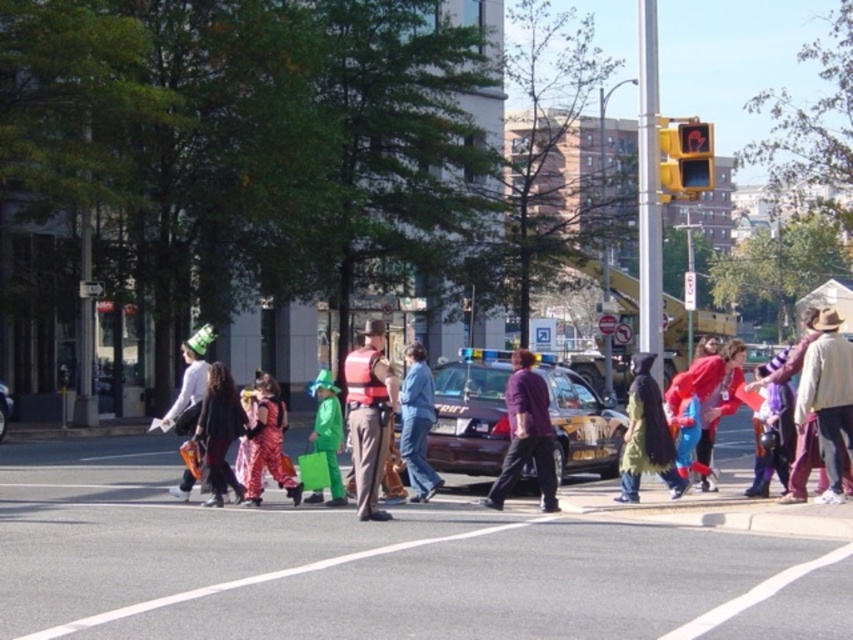
You are standing at the starting point of the pedestrian crosswalk and want to reach the point marked as point (228, 406). However, there is an obstacle at point (659, 394). Will you need to go around it to reach your destination?

Yes, you will need to go around the obstacle at point (659, 394) because it is in front of your destination point (228, 406).

You are a delivery drone flying above the street scene. You need to land on the dark brown asphalt at center. However, there is a green matte costume at center in the way. Can you safely land on the asphalt without hitting the costume?

The dark brown asphalt at center is smaller than the green matte costume at center, so the drone cannot safely land on the asphalt without risking collision with the costume.

You are a photographer trying to capture the entire scene of the matte white shirt at center and the metallic silver car at center in one shot. Based on their sizes, which object would require you to step back more to include both in the frame?

The matte white shirt at center has a larger width than the metallic silver car at center, so you would need to step back more to include the matte white shirt at center in the frame along with the metallic silver car at center.